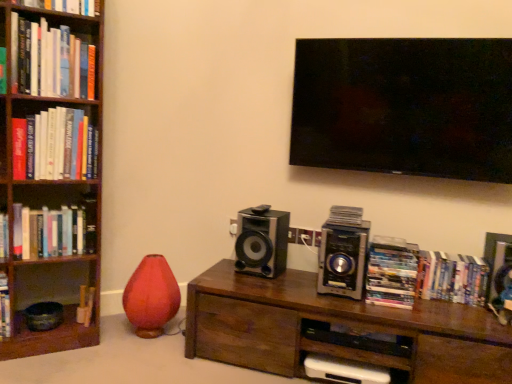
At what (x,y) coordinates should I click in order to perform the action: click on black glossy speaker at center, which appears as the second speaker when viewed from the right. Please return your answer as a coordinate pair (x, y). The image size is (512, 384). Looking at the image, I should click on (262, 241).

Where is `metallic silver speaker at center-right, which ranks as the 2th speaker in left-to-right order`? The width and height of the screenshot is (512, 384). metallic silver speaker at center-right, which ranks as the 2th speaker in left-to-right order is located at coordinates (343, 260).

Describe the element at coordinates (50, 61) in the screenshot. I see `hardcover books at left, the sixth book in the bottom-to-top sequence` at that location.

This screenshot has height=384, width=512. What do you see at coordinates (65, 6) in the screenshot?
I see `hardcover book at upper left, arranged as the 1th book when viewed from the top` at bounding box center [65, 6].

Where is `black glossy speaker at center, placed as the first speaker when sorted from left to right`? This screenshot has width=512, height=384. black glossy speaker at center, placed as the first speaker when sorted from left to right is located at coordinates click(262, 241).

Which is more to the right, hardcover book at upper left, arranged as the 1th book when viewed from the top, or brown wood table at center?

From the viewer's perspective, brown wood table at center appears more on the right side.

In the image, there is a hardcover book at upper left, arranged as the 1th book when viewed from the top. Where is `table below it (from a real-world perspective)`? The height and width of the screenshot is (384, 512). table below it (from a real-world perspective) is located at coordinates (335, 333).

Which object is wider, hardcover book at upper left, the fourth book positioned from the left, or brown wood table at center?

With larger width is brown wood table at center.

Are hardcover book at upper left, the fourth book positioned from the left, and brown wood table at center making contact?

There is a gap between hardcover book at upper left, the fourth book positioned from the left, and brown wood table at center.

Is hardcover books at center right, which appears as the 7th book when viewed from the left, facing towards hardcover book at upper left, the fourth book positioned from the left?

No, hardcover books at center right, which appears as the 7th book when viewed from the left, does not turn towards hardcover book at upper left, the fourth book positioned from the left.

Are hardcover books at center right, the 1th book from the right, and hardcover book at upper left, which is the 4th book in right-to-left order, making contact?

hardcover books at center right, the 1th book from the right, and hardcover book at upper left, which is the 4th book in right-to-left order, are clearly separated.

Is hardcover books at center right, the 1th book from the right, at the left side of hardcover book at upper left, arranged as the 1th book when viewed from the top?

In fact, hardcover books at center right, the 1th book from the right, is to the right of hardcover book at upper left, arranged as the 1th book when viewed from the top.

From the image's perspective, is hardcover books at center right, marked as the sixth book in a top-to-bottom arrangement, above or below hardcover book at upper left, the fourth book positioned from the left?

From the image's perspective, hardcover books at center right, marked as the sixth book in a top-to-bottom arrangement, appears below hardcover book at upper left, the fourth book positioned from the left.

Considering the relative sizes of hardcover books at left, which is the 5th book in right-to-left order, and wooden bookshelf at left in the image provided, is hardcover books at left, which is the 5th book in right-to-left order, bigger than wooden bookshelf at left?

Actually, hardcover books at left, which is the 5th book in right-to-left order, might be smaller than wooden bookshelf at left.

How far apart are hardcover books at left, which is the 5th book in right-to-left order, and wooden bookshelf at left?

The distance of hardcover books at left, which is the 5th book in right-to-left order, from wooden bookshelf at left is 7.96 inches.

From a real-world perspective, is hardcover books at left, which ranks as the third book in left-to-right order, under wooden bookshelf at left?

No, from a real-world perspective, hardcover books at left, which ranks as the third book in left-to-right order, is not below wooden bookshelf at left.

Between hardcover books at left, which is the 5th book in right-to-left order, and wooden bookshelf at left, which one has larger width?

wooden bookshelf at left is wider.

Are hardcover book at left, the seventh book from the top, and hardcover books at left, which is the 5th book in right-to-left order, far apart?

hardcover book at left, the seventh book from the top, is far away from hardcover books at left, which is the 5th book in right-to-left order.

From a real-world perspective, who is located lower, hardcover book at left, the 3th book viewed from the right, or hardcover books at left, which is the 5th book in right-to-left order?

hardcover book at left, the 3th book viewed from the right.

Which is nearer, (87,305) or (68,31)?

The point (68,31) is more forward.

Is black glossy speaker at center, placed as the first speaker when sorted from left to right, looking in the opposite direction of hardcover books at center right, the 1th book from the right?

black glossy speaker at center, placed as the first speaker when sorted from left to right, is not turned away from hardcover books at center right, the 1th book from the right.

Is black glossy speaker at center, placed as the first speaker when sorted from left to right, next to hardcover books at center right, the 1th book from the right, and touching it?

They are not placed beside each other.

How far apart are black glossy speaker at center, which appears as the second speaker when viewed from the right, and hardcover books at center right, which appears as the 7th book when viewed from the left?

black glossy speaker at center, which appears as the second speaker when viewed from the right, is 29.18 inches from hardcover books at center right, which appears as the 7th book when viewed from the left.

From the image's perspective, which is below, black glossy speaker at center, which appears as the second speaker when viewed from the right, or hardcover books at center right, the 1th book from the right?

hardcover books at center right, the 1th book from the right, is shown below in the image.

Is hardcover book at left, the fourth book viewed from the top, turned away from wooden bookshelf at left?

Yes, hardcover book at left, the fourth book viewed from the top,'s orientation is away from wooden bookshelf at left.

Between hardcover book at left, the fourth book positioned from the bottom, and wooden bookshelf at left, which one has more height?

With more height is wooden bookshelf at left.

Does point (68, 252) come in front of point (55, 171)?

No.

Do you think hardcover book at left, marked as the seventh book in a right-to-left arrangement, is within wooden bookshelf at left, or outside of it?

hardcover book at left, marked as the seventh book in a right-to-left arrangement, fits inside wooden bookshelf at left.

Does hardcover book at left, the fourth book positioned from the bottom, have a greater height compared to hardcover books at left, which is the 5th book in right-to-left order?

In fact, hardcover book at left, the fourth book positioned from the bottom, may be shorter than hardcover books at left, which is the 5th book in right-to-left order.

Is hardcover book at left, marked as the seventh book in a right-to-left arrangement, aimed at hardcover books at left, which is counted as the 2th book, starting from the top?

No, hardcover book at left, marked as the seventh book in a right-to-left arrangement, is not oriented towards hardcover books at left, which is counted as the 2th book, starting from the top.

Between hardcover book at left, the fourth book viewed from the top, and hardcover books at left, the sixth book in the bottom-to-top sequence, which one is positioned in front?

hardcover books at left, the sixth book in the bottom-to-top sequence, is more forward.

Image resolution: width=512 pixels, height=384 pixels. Identify the location of table on the right of the hardcover book at upper left, which is the 4th book in right-to-left order. (335, 333).

This screenshot has height=384, width=512. In order to click on the 5th book in front of the hardcover books at center right, marked as the sixth book in a top-to-bottom arrangement, counting from the anchor's position in this screenshot , I will do click(x=65, y=6).

Based on their spatial positions, is hardcover book at left, arranged as the second book when viewed from the left, or matte red vase at lower left further from wooden bookshelf at left?

matte red vase at lower left.

In the scene shown: Which object lies further to the anchor point brown wood table at center, wooden bookshelf at left or hardcover books at left, which is counted as the 2th book, starting from the top?

The object further to brown wood table at center is hardcover books at left, which is counted as the 2th book, starting from the top.

Considering their positions, is hardcover book at left, the fourth book viewed from the top, positioned further to hardcover book at left, arranged as the second book when viewed from the left, than black glossy speaker at center, which appears as the second speaker when viewed from the right?

black glossy speaker at center, which appears as the second speaker when viewed from the right, is further to hardcover book at left, arranged as the second book when viewed from the left.

Which object lies further to the anchor point hardcover book at upper left, which is the 7th book in bottom-to-top order, hardcover book at left, placed as the sixth book when sorted from right to left, or hardcover books at center right, the 1th book from the right?

hardcover books at center right, the 1th book from the right, is further to hardcover book at upper left, which is the 7th book in bottom-to-top order.

Which object lies further to the anchor point hardcover books at left, the sixth book in the bottom-to-top sequence, hardcover book at left, the fourth book viewed from the top, or metallic silver speaker at center-right, the 1th speaker viewed from the right?

metallic silver speaker at center-right, the 1th speaker viewed from the right, is positioned further to the anchor hardcover books at left, the sixth book in the bottom-to-top sequence.

Considering their positions, is wooden bookshelf at left positioned closer to black glossy speaker at center, which appears as the second speaker when viewed from the right, than hardcover book at upper left, arranged as the 1th book when viewed from the top?

Among the two, wooden bookshelf at left is located nearer to black glossy speaker at center, which appears as the second speaker when viewed from the right.

Looking at the image, which one is located further to black glossy speaker at center, which appears as the second speaker when viewed from the right, matte red vase at lower left or hardcover books at left, which is counted as the 2th book, starting from the top?

hardcover books at left, which is counted as the 2th book, starting from the top, lies further to black glossy speaker at center, which appears as the second speaker when viewed from the right, than the other object.

Based on the photo, based on their spatial positions, is black glossy speaker at center, which appears as the second speaker when viewed from the right, or hardcover books at center right, the 6th book in the left-to-right sequence, closer to metallic silver speaker at center-right, the 1th speaker viewed from the right?

Among the two, hardcover books at center right, the 6th book in the left-to-right sequence, is located nearer to metallic silver speaker at center-right, the 1th speaker viewed from the right.

Where is `vase between hardcover book at left, the fourth book viewed from the top, and hardcover books at center right, the 2th book when ordered from bottom to top, in the horizontal direction`? This screenshot has height=384, width=512. vase between hardcover book at left, the fourth book viewed from the top, and hardcover books at center right, the 2th book when ordered from bottom to top, in the horizontal direction is located at coordinates (151, 296).

Identify the location of vase between hardcover books at left, the sixth book in the bottom-to-top sequence, and hardcover book at left, the seventh book from the top, in the up-down direction. The height and width of the screenshot is (384, 512). (151, 296).

Where is `speaker situated between hardcover book at left, arranged as the second book when viewed from the left, and metallic silver speaker at center-right, which ranks as the 2th speaker in left-to-right order, from left to right`? The height and width of the screenshot is (384, 512). speaker situated between hardcover book at left, arranged as the second book when viewed from the left, and metallic silver speaker at center-right, which ranks as the 2th speaker in left-to-right order, from left to right is located at coordinates (262, 241).

Find the location of `book situated between hardcover book at left, the 3th book viewed from the right, and hardcover books at center right, the 2th book when ordered from bottom to top, from left to right`. book situated between hardcover book at left, the 3th book viewed from the right, and hardcover books at center right, the 2th book when ordered from bottom to top, from left to right is located at coordinates (391, 273).